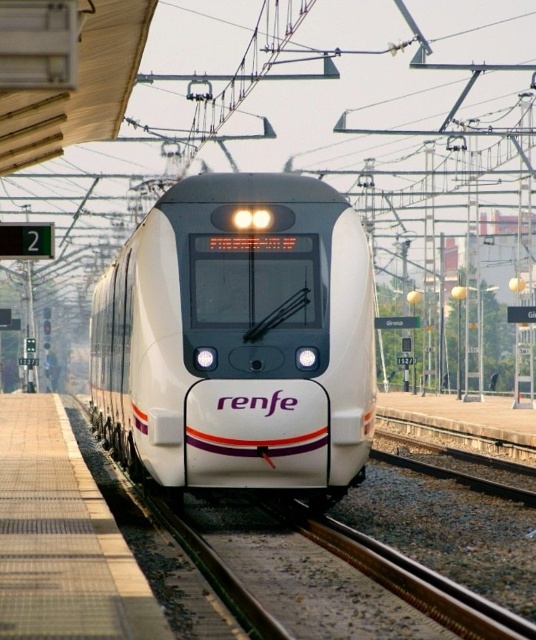
Question: Which point is closer to the camera?

Choices:
 (A) white glossy train at center
 (B) smooth concrete platform at lower left

Answer: (B)

Question: Considering the relative positions of white glossy train at center and smooth concrete platform at lower left in the image provided, where is white glossy train at center located with respect to smooth concrete platform at lower left?

Choices:
 (A) left
 (B) right

Answer: (B)

Question: Can you confirm if white glossy train at center is thinner than smooth concrete platform at lower left?

Choices:
 (A) yes
 (B) no

Answer: (A)

Question: Does white glossy train at center have a smaller size compared to smooth concrete platform at lower left?

Choices:
 (A) no
 (B) yes

Answer: (A)